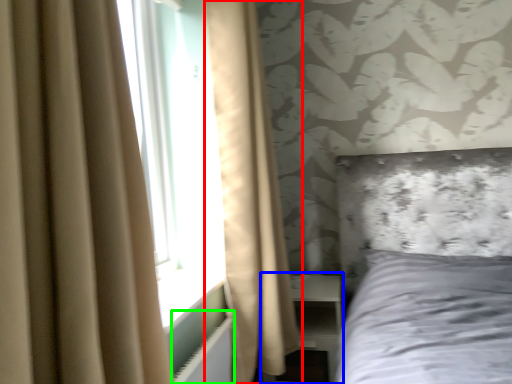
Question: Which object is the closest to the curtain (highlighted by a red box)? Choose among these: dresser (highlighted by a blue box) or radiator (highlighted by a green box).

Choices:
 (A) dresser
 (B) radiator

Answer: (A)